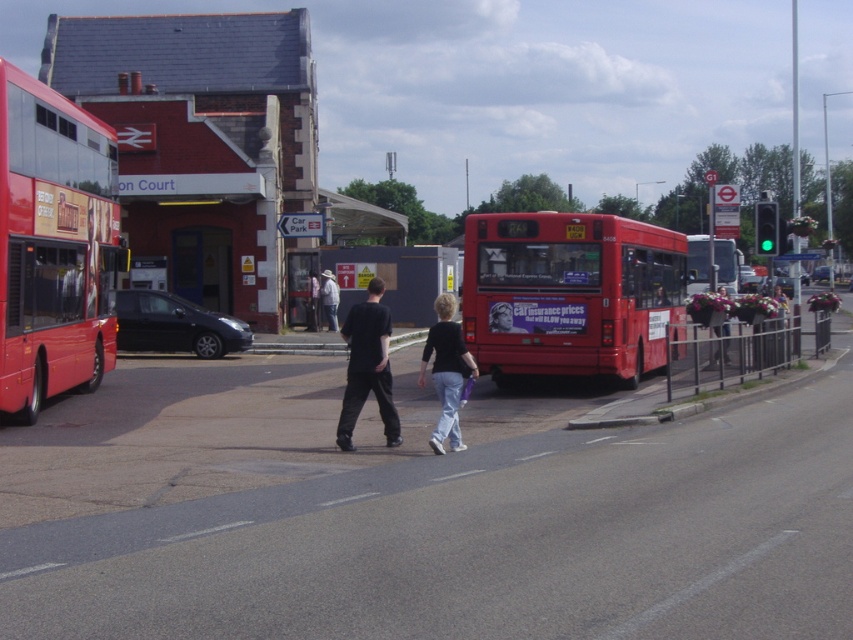
Based on the coordinates provided, where is the matte red bus at center located in the image?

The matte red bus at center is located at the coordinates point (572,292).

You are a pedestrian standing at the bus station. You see the matte red bus at center and the dark gray pants at center. Which object is closer to the ground?

The matte red bus at center is closer to the ground because it is located below the dark gray pants at center.

You are a delivery person needing to pass through the space between the matte red bus at center and the matte black jacket at center. Your delivery cart is 1.2 meters wide. Can your cart fit through the space between them?

The matte red bus at center is wider than the matte black jacket at center. However, the exact width difference isn not specified, so it is unclear if the 1.2 meter cart can fit through the space between them.